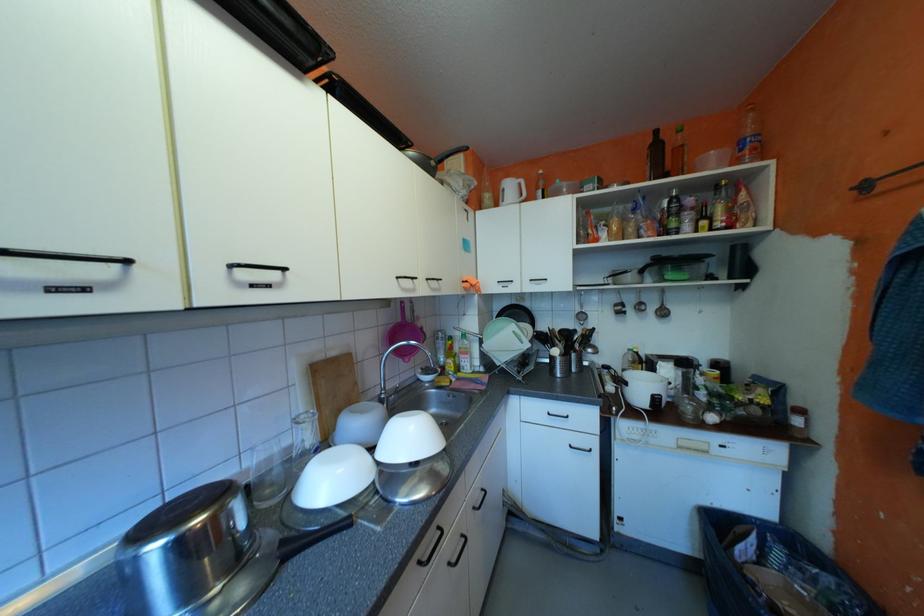
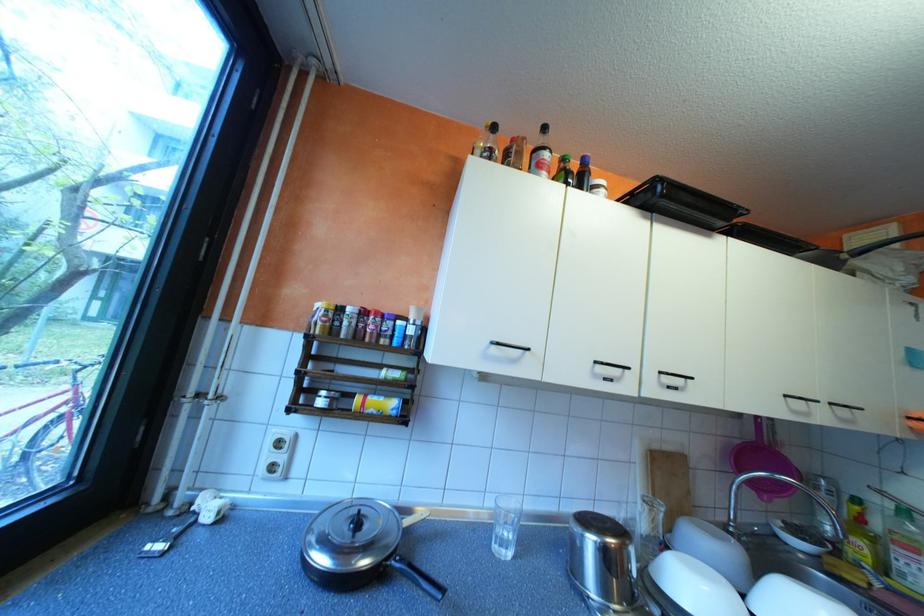
In the second image, find the point that corresponds to point 383,448 in the first image.

(752, 592)